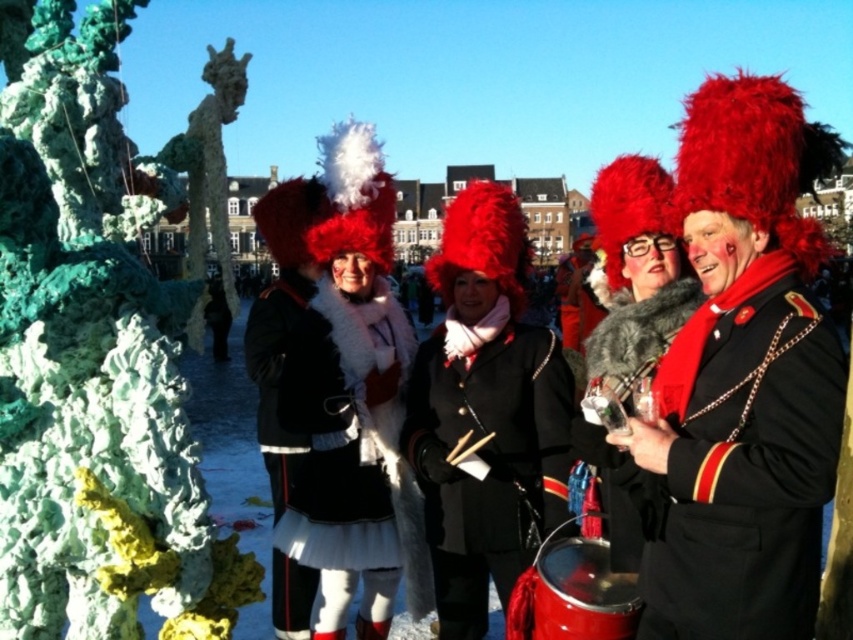
Does velvet red hat at center have a smaller size compared to fuzzy fur coat at center?

No, velvet red hat at center is not smaller than fuzzy fur coat at center.

Does velvet red hat at center appear over fuzzy fur coat at center?

Actually, velvet red hat at center is below fuzzy fur coat at center.

Which is in front, point (491, 566) or point (599, 353)?

Point (491, 566)

Find the location of a particular element. The height and width of the screenshot is (640, 853). velvet red hat at center is located at coordinates (485, 412).

Is white fur coat at center taller than fuzzy fur coat at center?

In fact, white fur coat at center may be shorter than fuzzy fur coat at center.

Does point (393, 400) come in front of point (630, 307)?

No.

You are a GUI agent. You are given a task and a screenshot of the screen. Output one action in this format:
    pyautogui.click(x=<x>, y=<y>)
    Task: Click on the white fur coat at center
    This screenshot has width=853, height=640.
    Given the screenshot: What is the action you would take?
    pyautogui.click(x=347, y=454)

Between velvet red coat at right and shiny red drum at lower center, which one has more height?

velvet red coat at right

Which is in front, point (715, 424) or point (635, 598)?

Positioned in front is point (715, 424).

Who is more forward, (674, 385) or (548, 634)?

Positioned in front is point (548, 634).

In order to click on velvet red coat at right in this screenshot , I will do `click(741, 461)`.